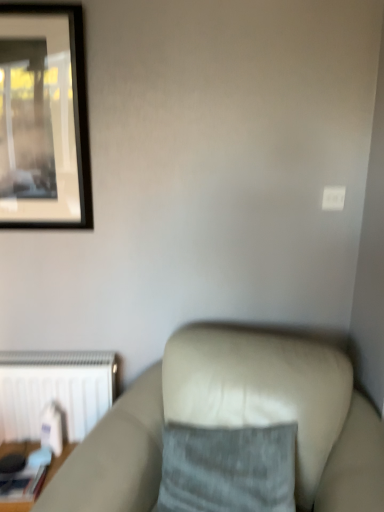
Question: Would you say white matte radiator at lower left contains gray fabric pillow at center?

Choices:
 (A) no
 (B) yes

Answer: (A)

Question: Does white matte radiator at lower left have a lesser width compared to gray fabric pillow at center?

Choices:
 (A) yes
 (B) no

Answer: (A)

Question: From a real-world perspective, is white matte radiator at lower left under gray fabric pillow at center?

Choices:
 (A) yes
 (B) no

Answer: (A)

Question: Is white matte radiator at lower left closer to the viewer compared to gray fabric pillow at center?

Choices:
 (A) yes
 (B) no

Answer: (B)

Question: Considering the relative sizes of white matte radiator at lower left and gray fabric pillow at center in the image provided, is white matte radiator at lower left smaller than gray fabric pillow at center?

Choices:
 (A) no
 (B) yes

Answer: (B)

Question: Does white matte radiator at lower left have a greater width compared to gray fabric pillow at center?

Choices:
 (A) no
 (B) yes

Answer: (A)

Question: Is there a large distance between wooden table at lower left and white matte radiator at lower left?

Choices:
 (A) no
 (B) yes

Answer: (A)

Question: Considering the relative positions of wooden table at lower left and white matte radiator at lower left in the image provided, is wooden table at lower left to the left of white matte radiator at lower left from the viewer's perspective?

Choices:
 (A) yes
 (B) no

Answer: (A)

Question: Is wooden table at lower left positioned with its back to white matte radiator at lower left?

Choices:
 (A) yes
 (B) no

Answer: (B)

Question: Is wooden table at lower left taller than white matte radiator at lower left?

Choices:
 (A) no
 (B) yes

Answer: (A)

Question: Does wooden table at lower left have a larger size compared to white matte radiator at lower left?

Choices:
 (A) yes
 (B) no

Answer: (B)

Question: From a real-world perspective, is wooden table at lower left located higher than white matte radiator at lower left?

Choices:
 (A) no
 (B) yes

Answer: (A)

Question: From a real-world perspective, is suede-like beige couch at lower right located beneath white matte radiator at lower left?

Choices:
 (A) yes
 (B) no

Answer: (A)